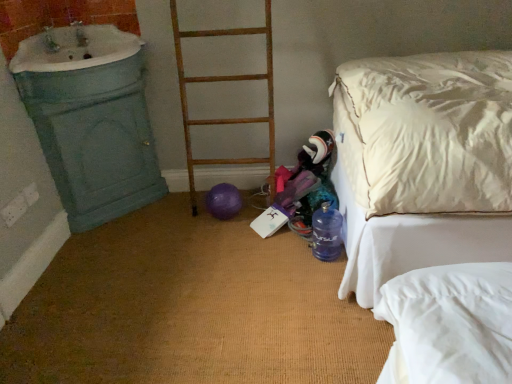
This screenshot has width=512, height=384. I want to click on free space to the right of purple rubber balloon at center, so click(254, 204).